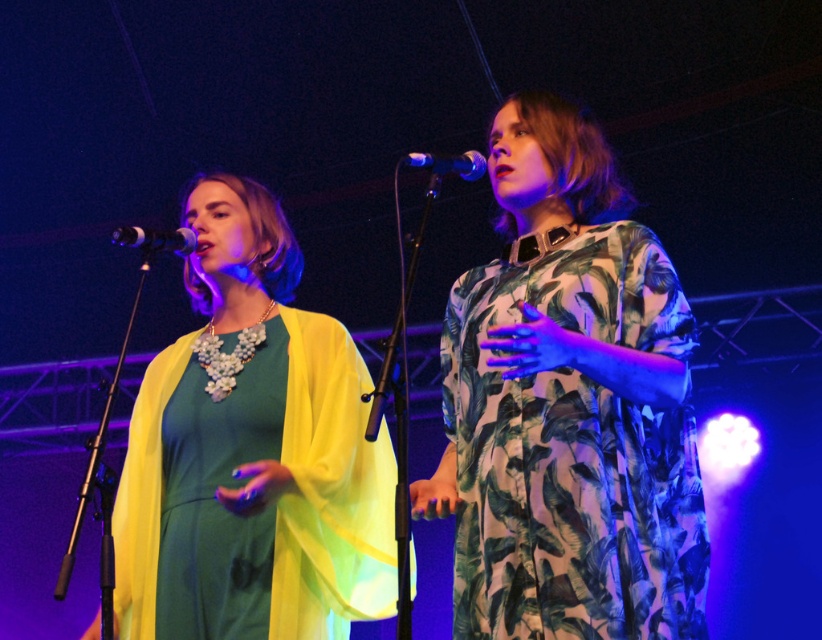
You are a stagehand setting up for a performance. You need to ensure that the green leafy fabric dress at center and the metallic silver microphone at center are visible to the audience. Since the dress is wider than the microphone, which object should you position closer to the front to avoid blocking the view of the narrower one?

Since the green leafy fabric dress at center is wider than the metallic silver microphone at center, you should position the metallic silver microphone at center closer to the front to ensure it isn not blocked by the wider dress.

You are a stagehand adjusting the lighting for the performance. You need to ensure the spotlight reaches both the matte green dress at center and the metallic silver microphone at left. Based on their positions, which object should you focus the spotlight on first to ensure it is illuminated properly?

The metallic silver microphone at left should be focused on first because the matte green dress at center is below it, so adjusting the spotlight from top to bottom will ensure proper illumination.